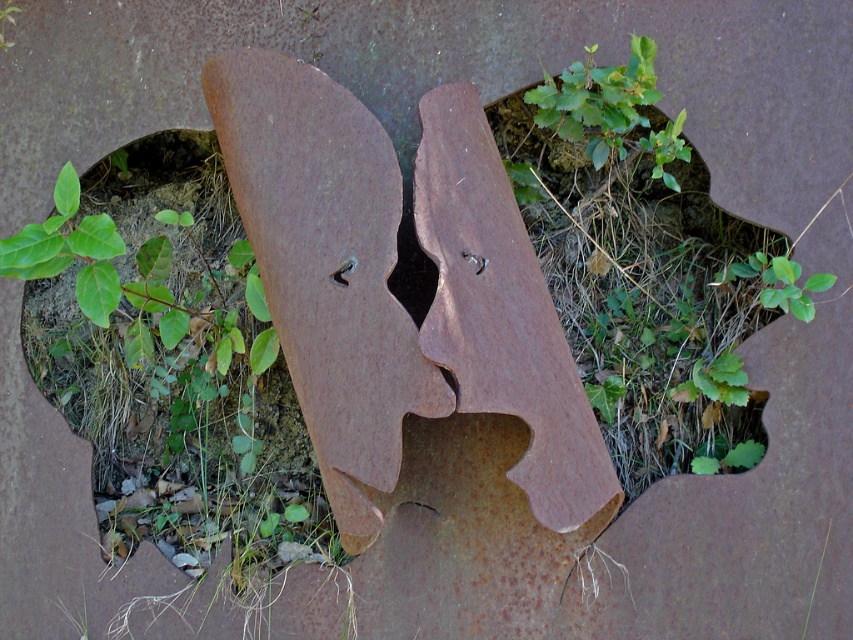
Can you confirm if green leafy plant at upper center is thinner than green leafy plant at center?

Incorrect, green leafy plant at upper center's width is not less than green leafy plant at center's.

Between green leafy plant at upper center and green leafy plant at center, which one appears on the left side from the viewer's perspective?

From the viewer's perspective, green leafy plant at upper center appears more on the left side.

Find the location of `green leafy plant at upper center`. green leafy plant at upper center is located at coordinates (598, 100).